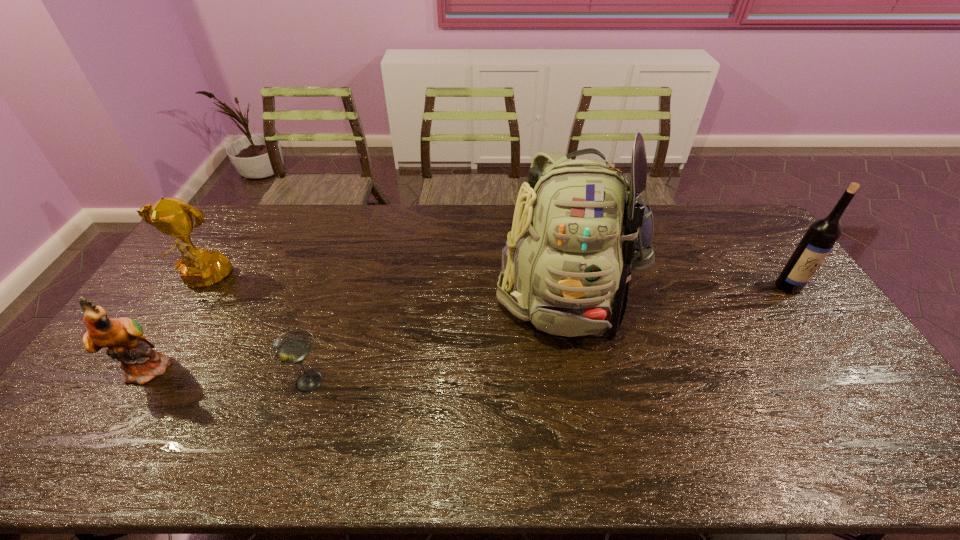
You are a GUI agent. You are given a task and a screenshot of the screen. Output one action in this format:
    pyautogui.click(x=<x>, y=<y>)
    Task: Click on the free space between the backpack and the martini
    This screenshot has height=540, width=960.
    Given the screenshot: What is the action you would take?
    pyautogui.click(x=436, y=336)

In order to click on the closest object to the award in this screenshot , I will do `click(123, 337)`.

Find the location of a particular element. The image size is (960, 540). object that stands as the third closest to the second object from right to left is located at coordinates (199, 268).

Locate an element on the screen. This screenshot has height=540, width=960. vacant space that satisfies the following two spatial constraints: 1. on the front side of the third object from left to right; 2. on the left side of the award is located at coordinates (138, 381).

The height and width of the screenshot is (540, 960). Find the location of `free region that satisfies the following two spatial constraints: 1. on the label of the rightmost object; 2. on the front-facing side of the parrot`. free region that satisfies the following two spatial constraints: 1. on the label of the rightmost object; 2. on the front-facing side of the parrot is located at coordinates (846, 368).

This screenshot has width=960, height=540. What are the coordinates of `free spot that satisfies the following two spatial constraints: 1. on the front side of the shortest object; 2. on the right side of the award` in the screenshot? It's located at (138, 381).

Identify the location of vacant position in the image that satisfies the following two spatial constraints: 1. on the front side of the shortest object; 2. on the right side of the award. (138, 381).

Locate an element on the screen. Image resolution: width=960 pixels, height=540 pixels. vacant area that satisfies the following two spatial constraints: 1. on the label of the wine bottle; 2. on the front-facing side of the parrot is located at coordinates (846, 368).